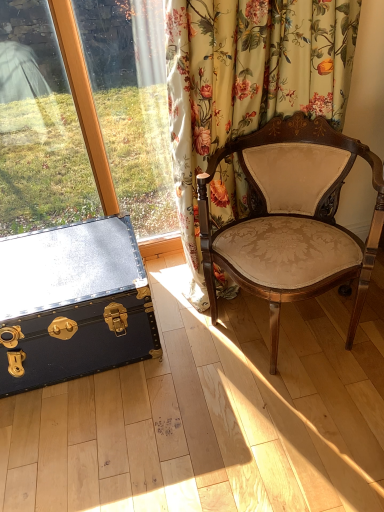
The image size is (384, 512). I want to click on free spot below velvet beige chair at center (from a real-world perspective), so click(x=291, y=330).